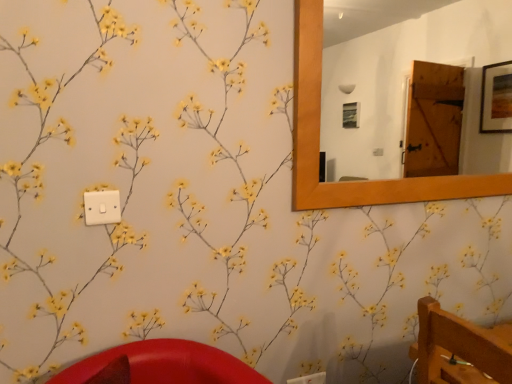
Question: Is white plastic light switch at upper left looking in the opposite direction of wooden frame mirror at upper right?

Choices:
 (A) yes
 (B) no

Answer: (B)

Question: Is white plastic light switch at upper left thinner than wooden frame mirror at upper right?

Choices:
 (A) no
 (B) yes

Answer: (B)

Question: From the image's perspective, is white plastic light switch at upper left located above wooden frame mirror at upper right?

Choices:
 (A) no
 (B) yes

Answer: (A)

Question: From the image's perspective, would you say white plastic light switch at upper left is shown under wooden frame mirror at upper right?

Choices:
 (A) no
 (B) yes

Answer: (B)

Question: Considering the relative sizes of white plastic light switch at upper left and wooden frame mirror at upper right in the image provided, is white plastic light switch at upper left smaller than wooden frame mirror at upper right?

Choices:
 (A) no
 (B) yes

Answer: (B)

Question: Does white plastic light switch at upper left have a greater width compared to wooden frame mirror at upper right?

Choices:
 (A) yes
 (B) no

Answer: (B)

Question: From the image's perspective, is wooden frame mirror at upper right located above white plastic light switch at upper left?

Choices:
 (A) yes
 (B) no

Answer: (A)

Question: Is wooden frame mirror at upper right further to the viewer compared to white plastic light switch at upper left?

Choices:
 (A) no
 (B) yes

Answer: (B)

Question: Does wooden frame mirror at upper right have a smaller size compared to white plastic light switch at upper left?

Choices:
 (A) no
 (B) yes

Answer: (A)

Question: Is wooden frame mirror at upper right in front of white plastic light switch at upper left?

Choices:
 (A) no
 (B) yes

Answer: (A)

Question: Is wooden frame mirror at upper right beside white plastic light switch at upper left?

Choices:
 (A) yes
 (B) no

Answer: (B)

Question: Is wooden frame mirror at upper right positioned beyond the bounds of white plastic light switch at upper left?

Choices:
 (A) yes
 (B) no

Answer: (A)

Question: From their relative heights in the image, would you say white plastic light switch at upper left is taller or shorter than wooden frame mirror at upper right?

Choices:
 (A) tall
 (B) short

Answer: (B)